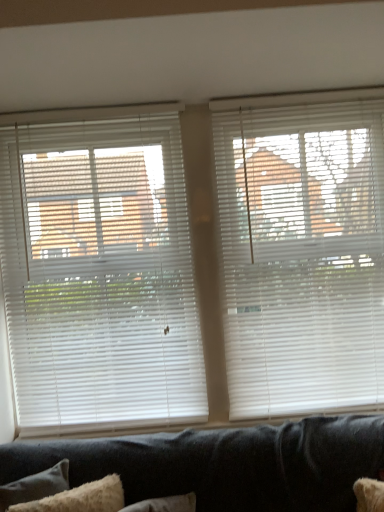
Question: Is fuzzy white pillow at lower left positioned before white plastic blinds at left, marked as the 2th window blind in a right-to-left arrangement?

Choices:
 (A) no
 (B) yes

Answer: (B)

Question: Can we say fuzzy white pillow at lower left lies outside white plastic blinds at left, the 1th window blind when ordered from left to right?

Choices:
 (A) no
 (B) yes

Answer: (B)

Question: From the image's perspective, is fuzzy white pillow at lower left over white plastic blinds at left, marked as the 2th window blind in a right-to-left arrangement?

Choices:
 (A) yes
 (B) no

Answer: (B)

Question: Could you tell me if fuzzy white pillow at lower left is turned towards white plastic blinds at left, marked as the 2th window blind in a right-to-left arrangement?

Choices:
 (A) yes
 (B) no

Answer: (B)

Question: From the image's perspective, is fuzzy white pillow at lower left below white plastic blinds at left, the 1th window blind when ordered from left to right?

Choices:
 (A) no
 (B) yes

Answer: (B)

Question: Considering the relative sizes of fuzzy white pillow at lower left and white plastic blinds at left, the 1th window blind when ordered from left to right, in the image provided, is fuzzy white pillow at lower left bigger than white plastic blinds at left, the 1th window blind when ordered from left to right,?

Choices:
 (A) no
 (B) yes

Answer: (A)

Question: Is white plastic blinds at upper right, acting as the 1th window blind starting from the right, oriented away from white plastic blinds at left, the 1th window blind when ordered from left to right?

Choices:
 (A) yes
 (B) no

Answer: (B)

Question: From a real-world perspective, is white plastic blinds at upper right, arranged as the second window blind when viewed from the left, on top of white plastic blinds at left, the 1th window blind when ordered from left to right?

Choices:
 (A) yes
 (B) no

Answer: (B)

Question: Is white plastic blinds at upper right, acting as the 1th window blind starting from the right, positioned beyond the bounds of white plastic blinds at left, marked as the 2th window blind in a right-to-left arrangement?

Choices:
 (A) no
 (B) yes

Answer: (B)

Question: Could you tell me if white plastic blinds at upper right, acting as the 1th window blind starting from the right, is turned towards white plastic blinds at left, the 1th window blind when ordered from left to right?

Choices:
 (A) no
 (B) yes

Answer: (A)

Question: From a real-world perspective, is white plastic blinds at upper right, acting as the 1th window blind starting from the right, beneath white plastic blinds at left, marked as the 2th window blind in a right-to-left arrangement?

Choices:
 (A) no
 (B) yes

Answer: (B)

Question: Considering the relative positions of white plastic blinds at upper right, arranged as the second window blind when viewed from the left, and white plastic blinds at left, marked as the 2th window blind in a right-to-left arrangement, in the image provided, is white plastic blinds at upper right, arranged as the second window blind when viewed from the left, to the left of white plastic blinds at left, marked as the 2th window blind in a right-to-left arrangement, from the viewer's perspective?

Choices:
 (A) no
 (B) yes

Answer: (A)

Question: From the image's perspective, is white plastic blinds at upper right, arranged as the second window blind when viewed from the left, below fuzzy white pillow at lower left?

Choices:
 (A) yes
 (B) no

Answer: (B)